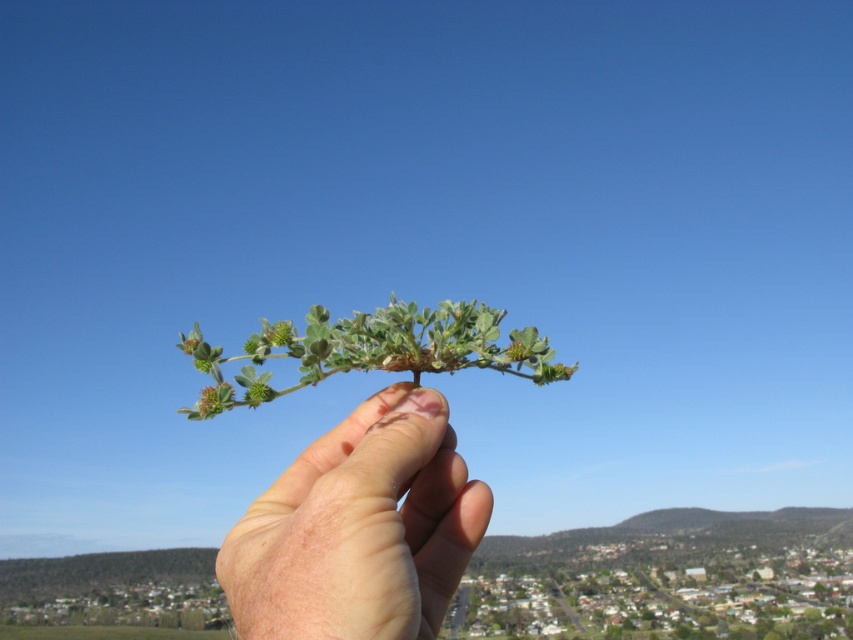
Can you confirm if pale skin/flesh at center is thinner than green matte leafy branch at center?

Yes.

Does point (281, 586) come farther from viewer compared to point (180, 412)?

No, it is not.

Where is `pale skin/flesh at center`? pale skin/flesh at center is located at coordinates (358, 529).

Find the location of a particular element. This screenshot has width=853, height=640. pale skin/flesh at center is located at coordinates (358, 529).